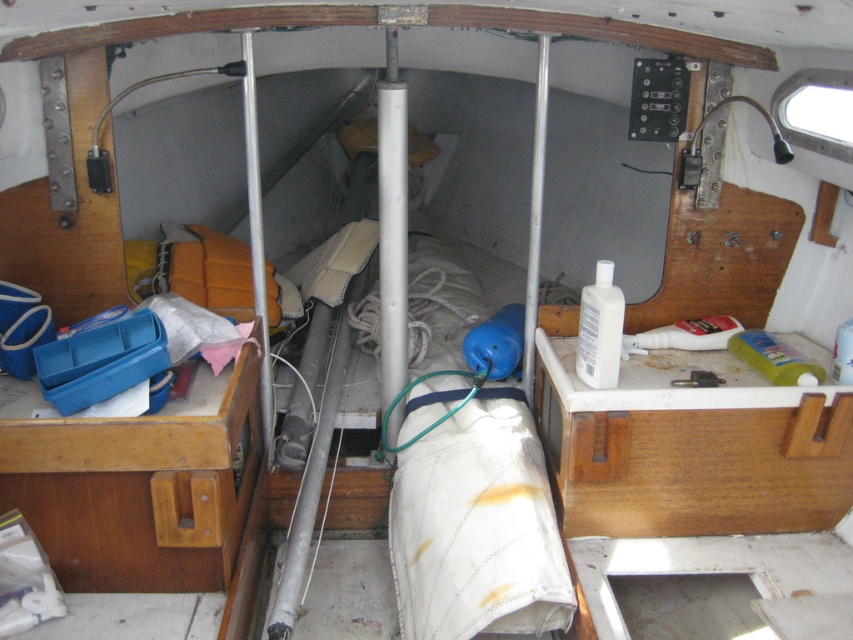
Question: Which point appears farthest from the camera in this image?

Choices:
 (A) click(x=692, y=371)
 (B) click(x=94, y=506)

Answer: (A)

Question: Among these objects, which one is farthest from the camera?

Choices:
 (A) wooden drawer at left
 (B) metallic silver tool at center

Answer: (B)

Question: Is wooden drawer at left in front of metallic silver tool at center?

Choices:
 (A) no
 (B) yes

Answer: (B)

Question: Does wooden drawer at left appear on the left side of metallic silver tool at center?

Choices:
 (A) no
 (B) yes

Answer: (B)

Question: Can you confirm if wooden drawer at left is positioned below metallic silver tool at center?

Choices:
 (A) no
 (B) yes

Answer: (B)